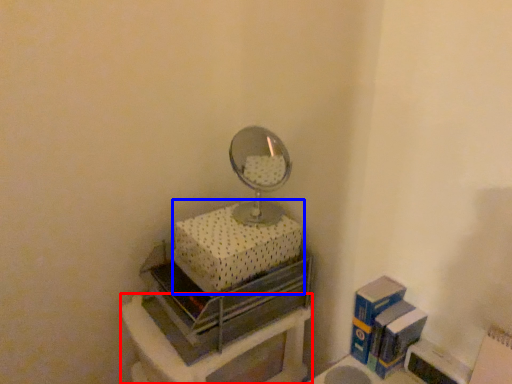
Question: Among these objects, which one is nearest to the camera, furniture (highlighted by a red box) or box (highlighted by a blue box)?

Choices:
 (A) furniture
 (B) box

Answer: (A)